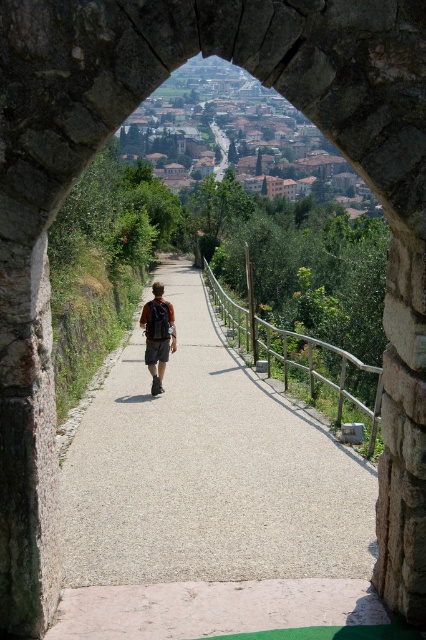
You are a hiker carrying a matte black backpack at center and want to place it on the light gray gravel path at center. Can you fit the backpack on the path?

The light gray gravel path at center is bigger than the matte black backpack at center, so yes, the backpack can fit on the path.

You are standing at the entrance of the stone archway and want to place your matte black backpack at center on the light gray gravel path at center. Can you do this without the backpack being completely hidden by the path?

The light gray gravel path at center is taller than matte black backpack at center, so placing the backpack on the path would result in the path partially or fully covering the backpack, making it hidden.